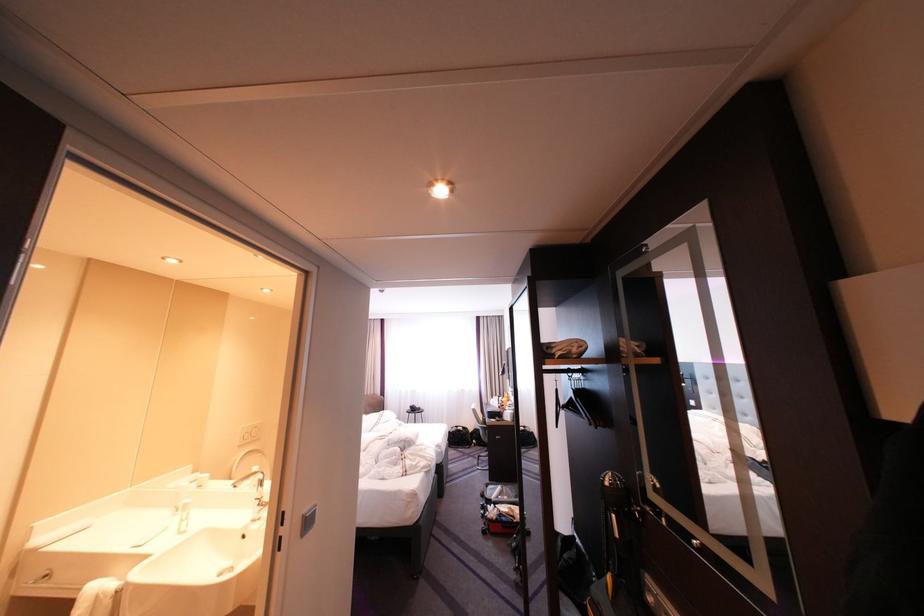
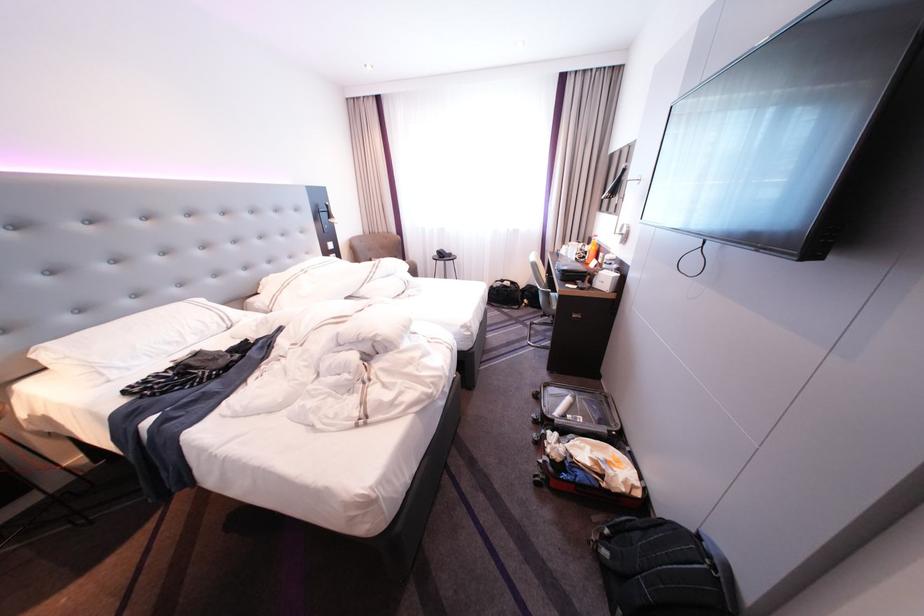
In the second image, find the point that corresponds to pixel 493 450 in the first image.

(546, 314)